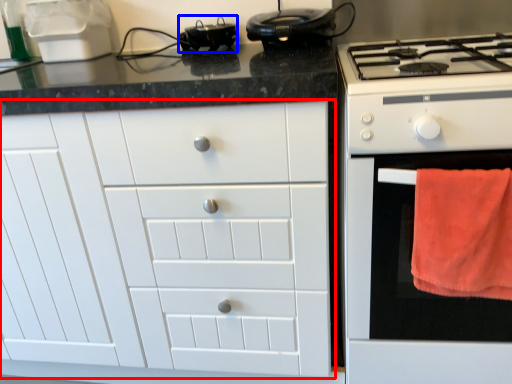
Question: Among these objects, which one is nearest to the camera, cabinetry (highlighted by a red box) or appliance (highlighted by a blue box)?

Choices:
 (A) cabinetry
 (B) appliance

Answer: (A)